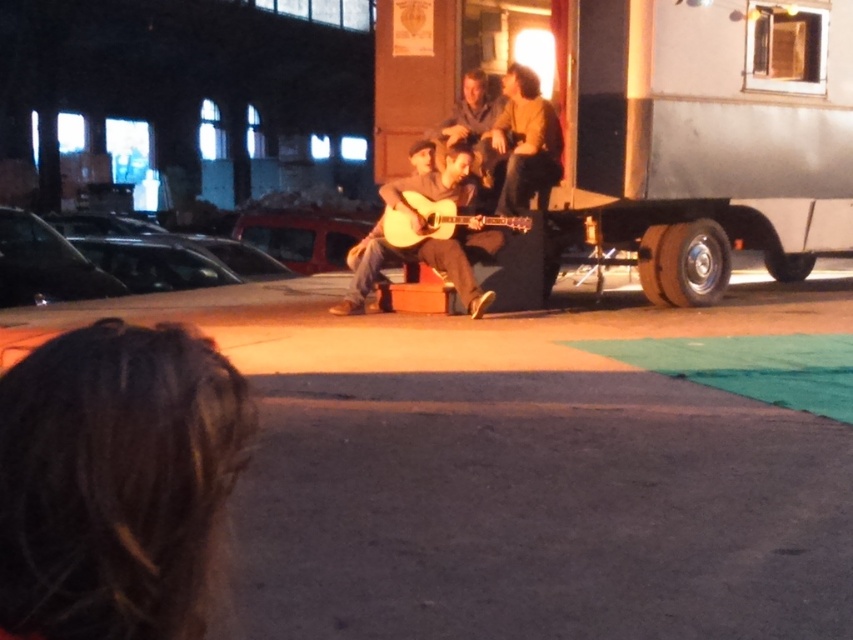
You are standing at the point with coordinates point (399,227) and want to walk towards the point with coordinates point (432,266). Will you have to move forward or backward to reach it?

Point (432,266) is behind point (399,227), so you will have to move backward to reach it.

You are a photographer trying to capture a clear shot of both the wooden acoustic guitar at center and the acoustic wood guitar at center. Since you can only focus on one guitar at a time, which one should you choose to ensure the other remains somewhat in focus?

The wooden acoustic guitar at center is closer to the viewer than the acoustic wood guitar at center. To ensure both are somewhat in focus, focus on the closer one, the wooden acoustic guitar at center, as depth of field will extend further back towards the farther guitar.

You are a photographer at the event and want to capture both the wooden acoustic guitar at center and the acoustic wood guitar at center in a single shot. Which guitar should you focus on first if you want the one closer to the camera to be in sharp focus?

The wooden acoustic guitar at center is below acoustic wood guitar at center, so you should focus on the acoustic wood guitar at center first since it is closer to the camera.